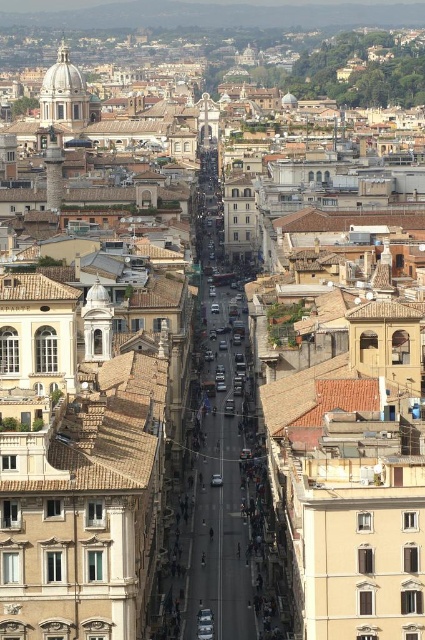
Based on the photo, is matte white dome at upper left below silver metallic car at center?

No, matte white dome at upper left is not below silver metallic car at center.

Where is `matte white dome at upper left`? matte white dome at upper left is located at coordinates (65, 93).

Describe the element at coordinates (65, 93) in the screenshot. This screenshot has width=425, height=640. I see `matte white dome at upper left` at that location.

I want to click on matte white dome at upper left, so click(x=65, y=93).